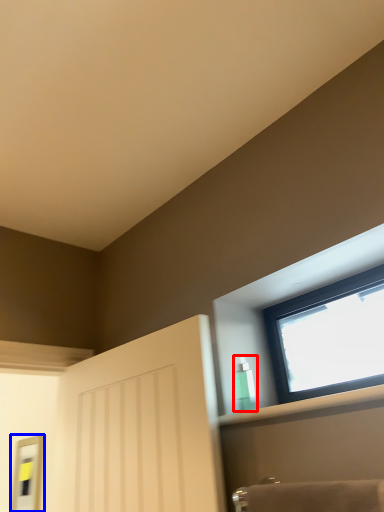
Question: Which object is closer to the camera taking this photo, toiletry (highlighted by a red box) or mirror (highlighted by a blue box)?

Choices:
 (A) toiletry
 (B) mirror

Answer: (A)